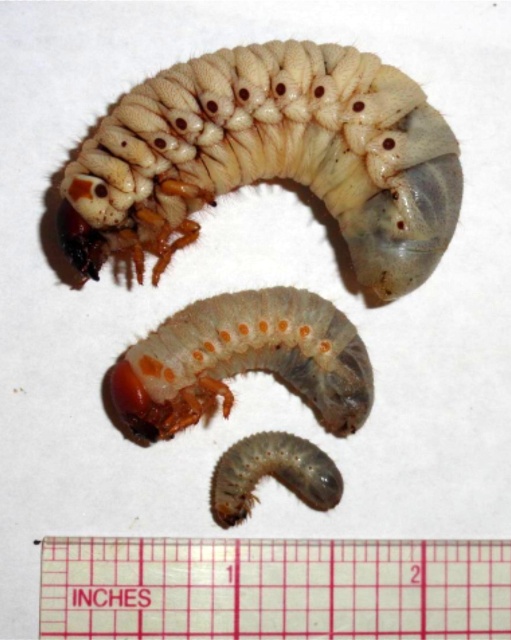
Is point (399, 148) closer to camera compared to point (265, 296)?

That is True.

Is translucent white caterpillar at upper center to the left of translucent gelatinous caterpillar at center from the viewer's perspective?

No, translucent white caterpillar at upper center is not to the left of translucent gelatinous caterpillar at center.

The image size is (511, 640). What are the coordinates of `translucent white caterpillar at upper center` in the screenshot? It's located at (268, 157).

You are a GUI agent. You are given a task and a screenshot of the screen. Output one action in this format:
    pyautogui.click(x=<x>, y=<y>)
    Task: Click on the translucent white caterpillar at upper center
    The height and width of the screenshot is (640, 511).
    Given the screenshot: What is the action you would take?
    pyautogui.click(x=268, y=157)

Who is positioned more to the right, transparent plastic ruler at lower center or translucent gelatinous caterpillar at center?

From the viewer's perspective, transparent plastic ruler at lower center appears more on the right side.

Can you confirm if transparent plastic ruler at lower center is positioned to the right of translucent gelatinous caterpillar at center?

Indeed, transparent plastic ruler at lower center is positioned on the right side of translucent gelatinous caterpillar at center.

Between point (393, 621) and point (240, 356), which one is positioned behind?

The point (240, 356) is more distant.

Locate an element on the screen. Image resolution: width=511 pixels, height=640 pixels. transparent plastic ruler at lower center is located at coordinates (272, 588).

Does translucent white caterpillar at upper center have a smaller size compared to transparent plastic ruler at lower center?

No.

Who is higher up, translucent white caterpillar at upper center or transparent plastic ruler at lower center?

translucent white caterpillar at upper center is above.

Where is `translucent white caterpillar at upper center`? This screenshot has height=640, width=511. translucent white caterpillar at upper center is located at coordinates [x=268, y=157].